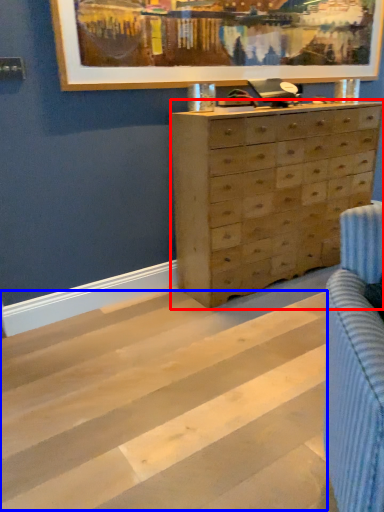
Question: Which point is closer to the camera, chest of drawers (highlighted by a red box) or stripe (highlighted by a blue box)?

Choices:
 (A) chest of drawers
 (B) stripe

Answer: (B)